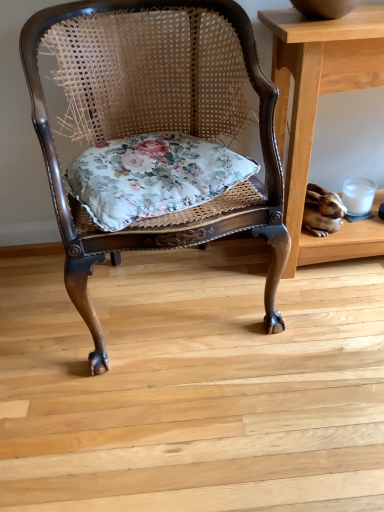
In order to click on rattan chair with floral cushion at center in this screenshot , I will do `click(156, 122)`.

What do you see at coordinates (316, 108) in the screenshot? I see `light brown wooden table at right` at bounding box center [316, 108].

Find the location of a particular element. floral fabric cushion at center is located at coordinates (157, 181).

Looking at this image, does floral fabric cushion at center turn towards rattan chair with floral cushion at center?

Yes, floral fabric cushion at center is oriented towards rattan chair with floral cushion at center.

In terms of height, does floral fabric cushion at center look taller or shorter compared to rattan chair with floral cushion at center?

Clearly, floral fabric cushion at center is shorter compared to rattan chair with floral cushion at center.

This screenshot has width=384, height=512. Find the location of `chair located underneath the floral fabric cushion at center (from a real-world perspective)`. chair located underneath the floral fabric cushion at center (from a real-world perspective) is located at coordinates (156, 122).

Can you tell me how much floral fabric cushion at center and rattan chair with floral cushion at center differ in facing direction?

The angular difference between floral fabric cushion at center and rattan chair with floral cushion at center is 12.7 degrees.

At what (x,y) coordinates should I click in order to perform the action: click on table behind the rattan chair with floral cushion at center. Please return your answer as a coordinate pair (x, y). Looking at the image, I should click on (316, 108).

Can you tell me how much rattan chair with floral cushion at center and light brown wooden table at right differ in facing direction?

→ rattan chair with floral cushion at center and light brown wooden table at right are facing 11.7 degrees away from each other.

Does rattan chair with floral cushion at center have a smaller size compared to light brown wooden table at right?

Actually, rattan chair with floral cushion at center might be larger than light brown wooden table at right.

Do you think rattan chair with floral cushion at center is within light brown wooden table at right, or outside of it?

rattan chair with floral cushion at center is not enclosed by light brown wooden table at right.

Do you think rattan chair with floral cushion at center is within floral fabric cushion at center, or outside of it?

rattan chair with floral cushion at center lies outside floral fabric cushion at center.

Considering the sizes of objects rattan chair with floral cushion at center and floral fabric cushion at center in the image provided, who is smaller, rattan chair with floral cushion at center or floral fabric cushion at center?

With smaller size is floral fabric cushion at center.

Is rattan chair with floral cushion at center oriented away from floral fabric cushion at center?

Correct, rattan chair with floral cushion at center is looking away from floral fabric cushion at center.

From the image's perspective, is light brown wooden table at right above floral fabric cushion at center?

Yes, from the image's perspective, light brown wooden table at right is on top of floral fabric cushion at center.

Is light brown wooden table at right facing away from floral fabric cushion at center?

No.

Identify the location of pillow above the light brown wooden table at right (from a real-world perspective). (157, 181).

From a real-world perspective, which object stands above the other?

floral fabric cushion at center is physically above.

Based on the photo, in the image, is floral fabric cushion at center positioned in front of or behind light brown wooden table at right?

Visually, floral fabric cushion at center is located in front of light brown wooden table at right.

Measure the distance from floral fabric cushion at center to light brown wooden table at right.

floral fabric cushion at center and light brown wooden table at right are 12.37 inches apart from each other.

Is floral fabric cushion at center not inside light brown wooden table at right?

That's correct, floral fabric cushion at center is outside of light brown wooden table at right.

Can you confirm if floral fabric cushion at center is wider than light brown wooden table at right?

Yes, floral fabric cushion at center is wider than light brown wooden table at right.

I want to click on table below the rattan chair with floral cushion at center (from a real-world perspective), so click(316, 108).

Is light brown wooden table at right spatially inside rattan chair with floral cushion at center, or outside of it?

The correct answer is: outside.

Is light brown wooden table at right next to rattan chair with floral cushion at center and touching it?

No, light brown wooden table at right is not in contact with rattan chair with floral cushion at center.

The image size is (384, 512). Find the location of `chair below the floral fabric cushion at center (from the image's perspective)`. chair below the floral fabric cushion at center (from the image's perspective) is located at coordinates (156, 122).

Where is `table located above the rattan chair with floral cushion at center (from the image's perspective)`? The width and height of the screenshot is (384, 512). table located above the rattan chair with floral cushion at center (from the image's perspective) is located at coordinates (316, 108).

Which object lies nearer to the anchor point floral fabric cushion at center, rattan chair with floral cushion at center or light brown wooden table at right?

rattan chair with floral cushion at center lies closer to floral fabric cushion at center than the other object.

From the image, which object appears to be farther from light brown wooden table at right, rattan chair with floral cushion at center or floral fabric cushion at center?

The object further to light brown wooden table at right is floral fabric cushion at center.

From the image, which object appears to be nearer to light brown wooden table at right, floral fabric cushion at center or rattan chair with floral cushion at center?

The object closer to light brown wooden table at right is rattan chair with floral cushion at center.

Estimate the real-world distances between objects in this image. Which object is further from floral fabric cushion at center, light brown wooden table at right or rattan chair with floral cushion at center?

The object further to floral fabric cushion at center is light brown wooden table at right.

When comparing their distances from rattan chair with floral cushion at center, does light brown wooden table at right or floral fabric cushion at center seem further?

light brown wooden table at right lies further to rattan chair with floral cushion at center than the other object.

Looking at the image, which one is located further to rattan chair with floral cushion at center, floral fabric cushion at center or light brown wooden table at right?

light brown wooden table at right is further to rattan chair with floral cushion at center.

The image size is (384, 512). What are the coordinates of `pillow between rattan chair with floral cushion at center and light brown wooden table at right in the horizontal direction` in the screenshot? It's located at (157, 181).